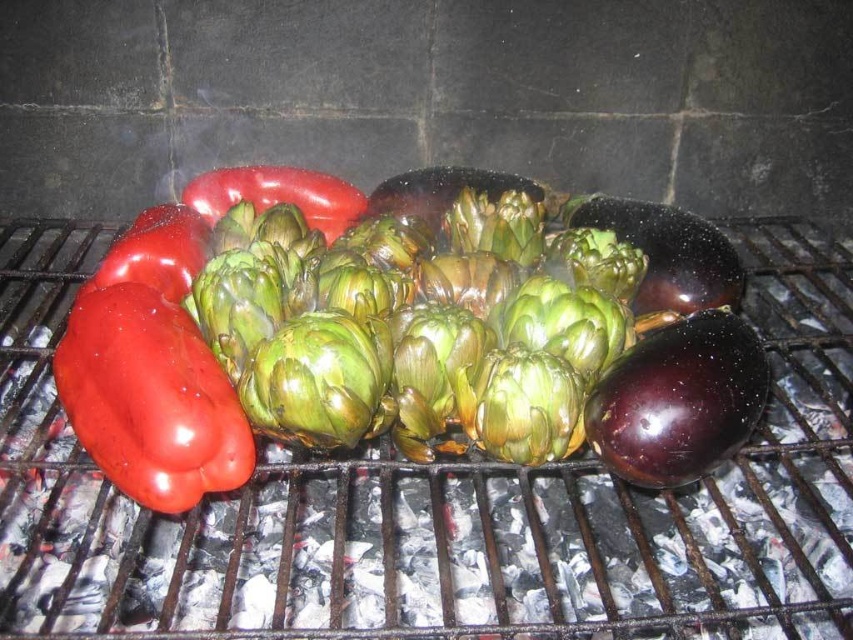
Based on the photo, you are a chef preparing a skewer for a customer who prefers vegetables with a larger surface area. Given the shiny red bell pepper at left and the shiny purple eggplant at right on the grill, which vegetable should you choose?

The shiny red bell pepper at left has a greater width than the shiny purple eggplant at right, so it offers a larger surface area and should be chosen.

You are a chef preparing a meal and need to know which vegetable is taller between the green matte artichoke at center and the shiny red bell pepper at left. Which one is taller?

The green matte artichoke at center is much taller than the shiny red bell pepper at left, so the green matte artichoke at center is taller.

You are a chef preparing a meal and need to know if the green matte artichoke at center can fit on a plate designed for the shiny red bell pepper at left. Based on their sizes, will the artichoke fit?

The green matte artichoke at center might be wider than the shiny red bell pepper at left, so it may not fit on the plate designed for the bell pepper.